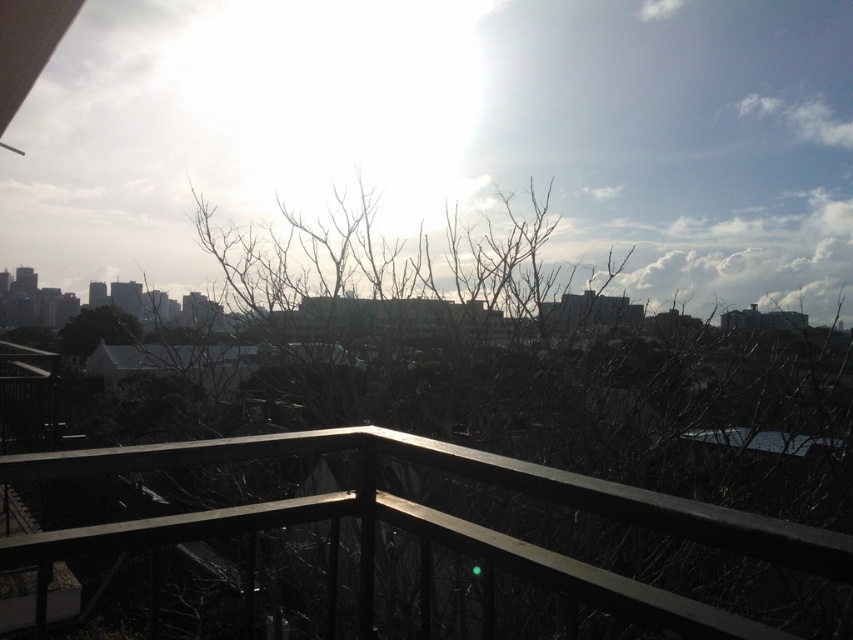
Question: Does black metal balustrade at center have a lesser width compared to green matte tree at center?

Choices:
 (A) yes
 (B) no

Answer: (B)

Question: Does black metal balustrade at center come behind green matte tree at center?

Choices:
 (A) no
 (B) yes

Answer: (A)

Question: Which of the following is the farthest from the observer?

Choices:
 (A) (74, 355)
 (B) (339, 428)

Answer: (A)

Question: Where is black metal balustrade at center located in relation to green matte tree at center in the image?

Choices:
 (A) above
 (B) below

Answer: (B)

Question: Which point is closer to the camera taking this photo?

Choices:
 (A) (107, 536)
 (B) (103, 333)

Answer: (A)